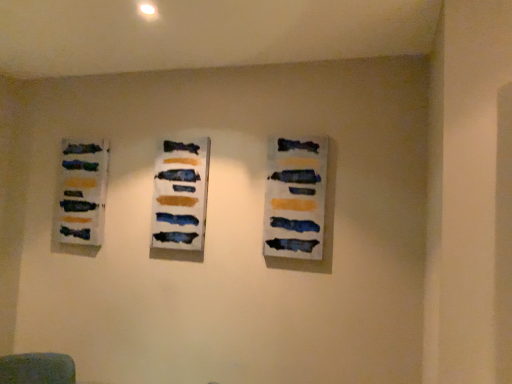
Where is `matte acrylic painting at center, the second art exhibition viewed from the front`? The image size is (512, 384). matte acrylic painting at center, the second art exhibition viewed from the front is located at coordinates (181, 195).

In order to face matte acrylic painting at center, which ranks as the first art exhibition in right-to-left order, should I rotate leftwards or rightwards?

Turn right approximately 5.387 degrees to face it.

This screenshot has height=384, width=512. In order to click on matte acrylic painting at center, which ranks as the 2th art exhibition in left-to-right order in this screenshot , I will do `click(181, 195)`.

Is textured acrylic painting at left, acting as the first art exhibition starting from the back, far from matte acrylic painting at center, the second art exhibition viewed from the front?

textured acrylic painting at left, acting as the first art exhibition starting from the back, is actually quite close to matte acrylic painting at center, the second art exhibition viewed from the front.

Image resolution: width=512 pixels, height=384 pixels. Identify the location of art exhibition above the matte acrylic painting at center, the second art exhibition viewed from the front (from the image's perspective). (82, 192).

Is textured acrylic painting at left, the 1th art exhibition when ordered from left to right, behind matte acrylic painting at center, acting as the 2th art exhibition starting from the back?

Yes, it is behind matte acrylic painting at center, acting as the 2th art exhibition starting from the back.

In terms of size, does textured acrylic painting at left, the 1th art exhibition when ordered from left to right, appear bigger or smaller than matte acrylic painting at center, which ranks as the second art exhibition in right-to-left order?

textured acrylic painting at left, the 1th art exhibition when ordered from left to right, is bigger than matte acrylic painting at center, which ranks as the second art exhibition in right-to-left order.

Considering the points (57, 221) and (283, 161), which point is in front, point (57, 221) or point (283, 161)?

Positioned in front is point (283, 161).

Between textured acrylic painting at left, acting as the first art exhibition starting from the back, and matte acrylic painting at center, marked as the first art exhibition in a front-to-back arrangement, which one has smaller width?

matte acrylic painting at center, marked as the first art exhibition in a front-to-back arrangement.

Do you think textured acrylic painting at left, the 1th art exhibition when ordered from left to right, is within matte acrylic painting at center, which ranks as the first art exhibition in right-to-left order, or outside of it?

textured acrylic painting at left, the 1th art exhibition when ordered from left to right, cannot be found inside matte acrylic painting at center, which ranks as the first art exhibition in right-to-left order.

Could you measure the distance between textured acrylic painting at left, the 1th art exhibition when ordered from left to right, and matte acrylic painting at center, which ranks as the first art exhibition in right-to-left order?

3.61 feet.

Which of these two, matte acrylic painting at center, which ranks as the first art exhibition in right-to-left order, or textured acrylic painting at left, acting as the first art exhibition starting from the back, is bigger?

textured acrylic painting at left, acting as the first art exhibition starting from the back, is bigger.

Are matte acrylic painting at center, the third art exhibition from the back, and textured acrylic painting at left, the 1th art exhibition when ordered from left to right, beside each other?

No.

From the picture: Would you say matte acrylic painting at center, the third art exhibition from the back, is inside or outside textured acrylic painting at left, acting as the first art exhibition starting from the back?

matte acrylic painting at center, the third art exhibition from the back, is not enclosed by textured acrylic painting at left, acting as the first art exhibition starting from the back.

Is matte acrylic painting at center, which ranks as the first art exhibition in right-to-left order, taller than matte acrylic painting at center, acting as the 2th art exhibition starting from the back?

No.

There is a matte acrylic painting at center, the third art exhibition from the left. Find the location of `the 2nd art exhibition below it (from a real-world perspective)`. the 2nd art exhibition below it (from a real-world perspective) is located at coordinates (181, 195).

Is matte acrylic painting at center, the third art exhibition from the left, not close to matte acrylic painting at center, the second art exhibition viewed from the front?

matte acrylic painting at center, the third art exhibition from the left, is actually quite close to matte acrylic painting at center, the second art exhibition viewed from the front.

Are matte acrylic painting at center, acting as the 2th art exhibition starting from the back, and textured acrylic painting at left, the 1th art exhibition when ordered from left to right, located far from each other?

No, there isn't a large distance between matte acrylic painting at center, acting as the 2th art exhibition starting from the back, and textured acrylic painting at left, the 1th art exhibition when ordered from left to right.

Considering the sizes of objects matte acrylic painting at center, acting as the 2th art exhibition starting from the back, and textured acrylic painting at left, the 1th art exhibition when ordered from left to right, in the image provided, who is shorter, matte acrylic painting at center, acting as the 2th art exhibition starting from the back, or textured acrylic painting at left, the 1th art exhibition when ordered from left to right,?

With less height is textured acrylic painting at left, the 1th art exhibition when ordered from left to right.

Looking at this image, could you tell me if matte acrylic painting at center, which ranks as the 2th art exhibition in left-to-right order, is turned towards textured acrylic painting at left, acting as the 3th art exhibition starting from the front?

No, matte acrylic painting at center, which ranks as the 2th art exhibition in left-to-right order, does not turn towards textured acrylic painting at left, acting as the 3th art exhibition starting from the front.

From the image's perspective, relative to textured acrylic painting at left, acting as the 3th art exhibition starting from the front, is matte acrylic painting at center, the second art exhibition viewed from the front, above or below?

Based on their image positions, matte acrylic painting at center, the second art exhibition viewed from the front, is located beneath textured acrylic painting at left, acting as the 3th art exhibition starting from the front.

From the picture: Who is smaller, matte acrylic painting at center, the second art exhibition viewed from the front, or matte acrylic painting at center, the third art exhibition from the left?

matte acrylic painting at center, the third art exhibition from the left, is smaller.

Considering the relative positions of matte acrylic painting at center, which ranks as the 2th art exhibition in left-to-right order, and matte acrylic painting at center, which ranks as the first art exhibition in right-to-left order, in the image provided, is matte acrylic painting at center, which ranks as the 2th art exhibition in left-to-right order, behind matte acrylic painting at center, which ranks as the first art exhibition in right-to-left order,?

That is True.

From the image's perspective, would you say matte acrylic painting at center, which ranks as the 2th art exhibition in left-to-right order, is shown under matte acrylic painting at center, the third art exhibition from the back?

Actually, matte acrylic painting at center, which ranks as the 2th art exhibition in left-to-right order, appears above matte acrylic painting at center, the third art exhibition from the back, in the image.

Starting from the matte acrylic painting at center, which ranks as the first art exhibition in right-to-left order, which art exhibition is the 1st one to the left? Please provide its 2D coordinates.

[(181, 195)]

Starting from the textured acrylic painting at left, the 1th art exhibition when ordered from left to right, which art exhibition is the 1st one in front? Please provide its 2D coordinates.

[(181, 195)]

What are the coordinates of `art exhibition that is the 2nd object located below the textured acrylic painting at left, acting as the third art exhibition starting from the right (from the image's perspective)` in the screenshot? It's located at (295, 198).

From the image, which object appears to be nearer to matte acrylic painting at center, which ranks as the 2th art exhibition in left-to-right order, textured acrylic painting at left, acting as the third art exhibition starting from the right, or matte acrylic painting at center, the third art exhibition from the back?

matte acrylic painting at center, the third art exhibition from the back, is closer to matte acrylic painting at center, which ranks as the 2th art exhibition in left-to-right order.

Estimate the real-world distances between objects in this image. Which object is closer to matte acrylic painting at center, marked as the first art exhibition in a front-to-back arrangement, textured acrylic painting at left, the 1th art exhibition when ordered from left to right, or matte acrylic painting at center, which ranks as the second art exhibition in right-to-left order?

The object closer to matte acrylic painting at center, marked as the first art exhibition in a front-to-back arrangement, is matte acrylic painting at center, which ranks as the second art exhibition in right-to-left order.

Looking at the image, which one is located closer to matte acrylic painting at center, which ranks as the first art exhibition in right-to-left order, matte acrylic painting at center, acting as the 2th art exhibition starting from the back, or textured acrylic painting at left, acting as the third art exhibition starting from the right?

The object closer to matte acrylic painting at center, which ranks as the first art exhibition in right-to-left order, is matte acrylic painting at center, acting as the 2th art exhibition starting from the back.

Considering their positions, is matte acrylic painting at center, acting as the 2th art exhibition starting from the back, positioned closer to textured acrylic painting at left, acting as the 3th art exhibition starting from the front, than matte acrylic painting at center, the third art exhibition from the left?

matte acrylic painting at center, acting as the 2th art exhibition starting from the back, is positioned closer to the anchor textured acrylic painting at left, acting as the 3th art exhibition starting from the front.

Looking at the image, which one is located further to textured acrylic painting at left, acting as the 3th art exhibition starting from the front, matte acrylic painting at center, marked as the first art exhibition in a front-to-back arrangement, or matte acrylic painting at center, which ranks as the 2th art exhibition in left-to-right order?

Among the two, matte acrylic painting at center, marked as the first art exhibition in a front-to-back arrangement, is located further to textured acrylic painting at left, acting as the 3th art exhibition starting from the front.

Considering their positions, is matte acrylic painting at center, the third art exhibition from the left, positioned further to matte acrylic painting at center, which ranks as the second art exhibition in right-to-left order, than textured acrylic painting at left, acting as the 3th art exhibition starting from the front?

textured acrylic painting at left, acting as the 3th art exhibition starting from the front.

Find the location of a particular element. This screenshot has height=384, width=512. art exhibition between textured acrylic painting at left, acting as the 3th art exhibition starting from the front, and matte acrylic painting at center, the third art exhibition from the back, from left to right is located at coordinates (181, 195).